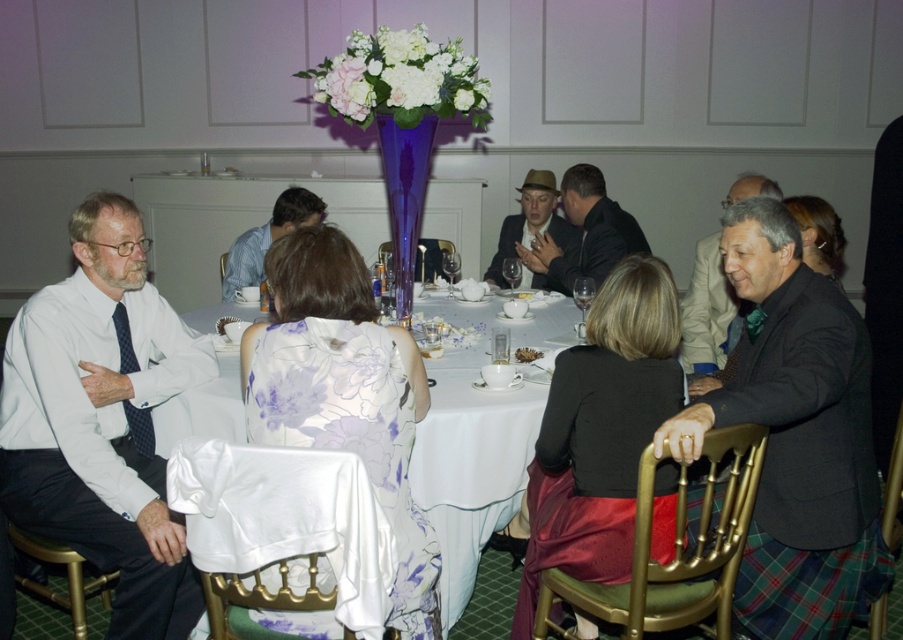
You are a guest at this formal event and notice the white satin tablecloth at center and the matte black jacket at center. Which item is positioned lower in relation to the other?

The white satin tablecloth at center is located below the matte black jacket at center, so it is positioned lower.